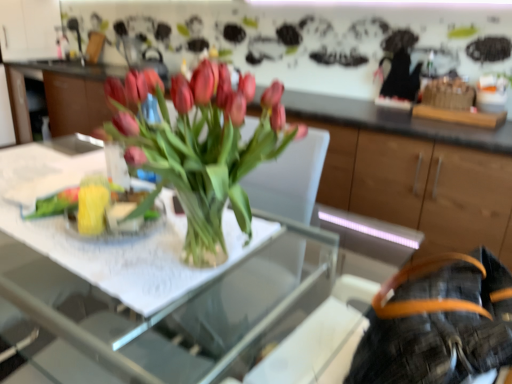
Question: Considering the relative sizes of clear glass table at center and clear glass vase at center in the image provided, is clear glass table at center thinner than clear glass vase at center?

Choices:
 (A) yes
 (B) no

Answer: (B)

Question: From a real-world perspective, is clear glass table at center over clear glass vase at center?

Choices:
 (A) no
 (B) yes

Answer: (A)

Question: Considering the relative sizes of clear glass table at center and clear glass vase at center in the image provided, is clear glass table at center wider than clear glass vase at center?

Choices:
 (A) no
 (B) yes

Answer: (B)

Question: Can you confirm if clear glass table at center is smaller than clear glass vase at center?

Choices:
 (A) yes
 (B) no

Answer: (B)

Question: From the image's perspective, is clear glass table at center over clear glass vase at center?

Choices:
 (A) yes
 (B) no

Answer: (B)

Question: Considering the relative sizes of clear glass table at center and clear glass vase at center in the image provided, is clear glass table at center bigger than clear glass vase at center?

Choices:
 (A) yes
 (B) no

Answer: (A)

Question: Is clear glass vase at center turned away from orange leather belt at lower right?

Choices:
 (A) no
 (B) yes

Answer: (A)

Question: From a real-world perspective, is clear glass vase at center physically below orange leather belt at lower right?

Choices:
 (A) yes
 (B) no

Answer: (B)

Question: Is clear glass vase at center outside orange leather belt at lower right?

Choices:
 (A) no
 (B) yes

Answer: (B)

Question: Does clear glass vase at center have a lesser width compared to orange leather belt at lower right?

Choices:
 (A) yes
 (B) no

Answer: (A)

Question: From the image's perspective, does clear glass vase at center appear lower than orange leather belt at lower right?

Choices:
 (A) yes
 (B) no

Answer: (B)

Question: From the image's perspective, would you say clear glass vase at center is positioned over orange leather belt at lower right?

Choices:
 (A) yes
 (B) no

Answer: (A)

Question: Is orange leather belt at lower right with clear glass vase at center?

Choices:
 (A) no
 (B) yes

Answer: (A)